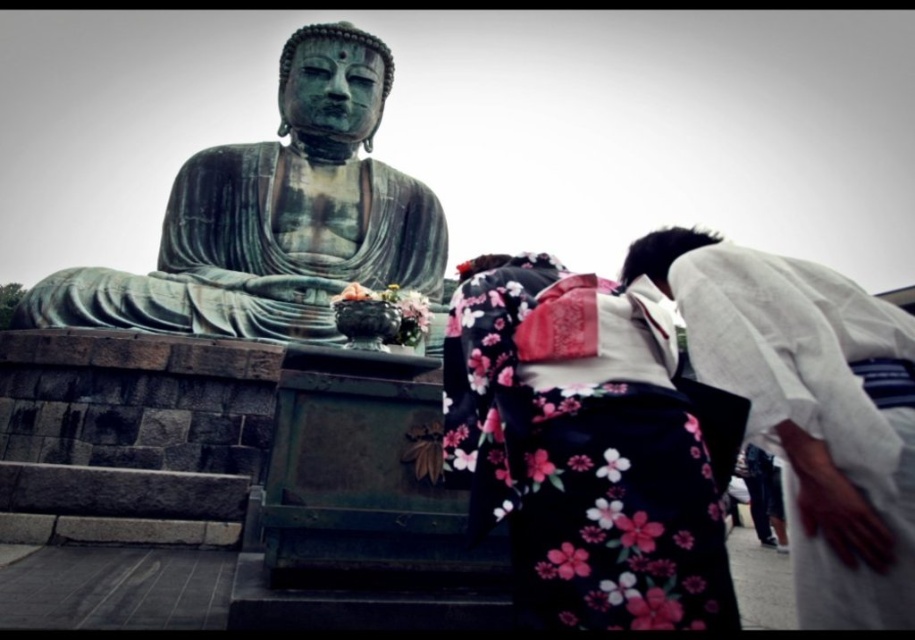
From the picture: You are a photographer trying to capture both the floral kimono at center and the white cotton kimono at lower right in a single frame. Given their sizes, which kimono should you focus on to ensure both are clearly visible in the photo?

The floral kimono at center is larger in size than the white cotton kimono at lower right, so focusing on the floral kimono at center will help ensure both are clearly visible in the photo.

Based on the photo, you are a photographer trying to capture the entire scene in one shot. Given that the floral kimono at center and the green patina statue at center are both in your frame, which object appears wider in the photo?

The green patina statue at center appears wider in the photo because the floral kimono at center has a lesser width compared to it.

Based on the photo, you are a photographer standing at the back of the scene. You want to take a photo that includes both the green patina statue at center and the white cotton kimono at lower right. Which object should you adjust your camera focus on first to ensure both are in the frame?

You should focus on the green patina statue at center first because it is closer to you than the white cotton kimono at lower right, so adjusting focus on the closer object ensures both are in frame.